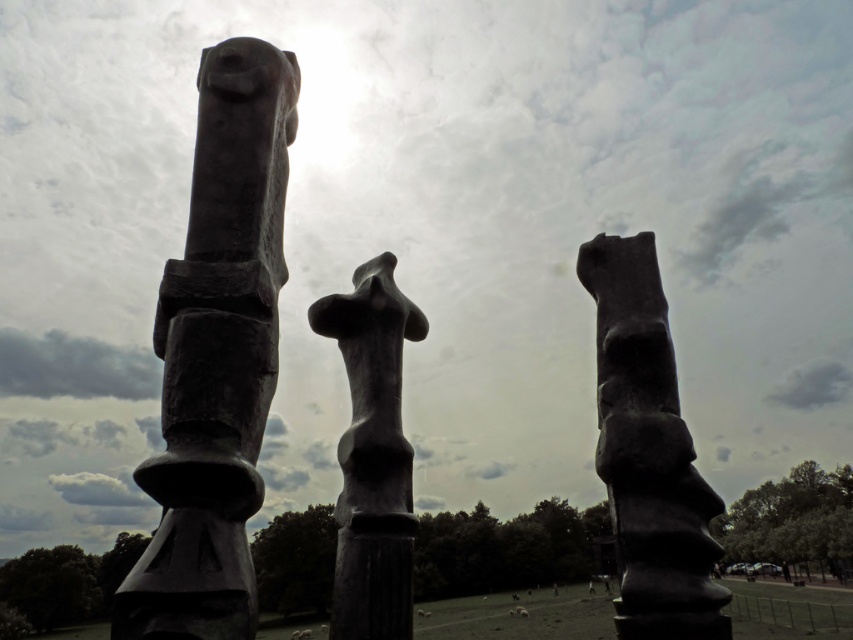
Who is more distant from viewer, (595,266) or (332,312)?

The point (332,312) is behind.

Is point (622, 580) farther from camera compared to point (410, 339)?

That is False.

Is point (639, 298) farther from viewer compared to point (358, 340)?

That is False.

Where is `matte black totem pole at center`? The image size is (853, 640). matte black totem pole at center is located at coordinates (648, 452).

You are a GUI agent. You are given a task and a screenshot of the screen. Output one action in this format:
    pyautogui.click(x=<x>, y=<y>)
    Task: Click on the matte black sculpture at left
    The width and height of the screenshot is (853, 640).
    Given the screenshot: What is the action you would take?
    pyautogui.click(x=218, y=355)

Describe the element at coordinates (218, 355) in the screenshot. I see `matte black sculpture at left` at that location.

Describe the element at coordinates (218, 355) in the screenshot. I see `matte black sculpture at left` at that location.

What are the coordinates of `matte black sculpture at left` in the screenshot? It's located at (218, 355).

Does matte black sculpture at left come in front of matte black totem pole at center?

That is True.

Between point (238, 422) and point (675, 460), which one is positioned in front?

Point (238, 422)

The height and width of the screenshot is (640, 853). Identify the location of matte black sculpture at left. (218, 355).